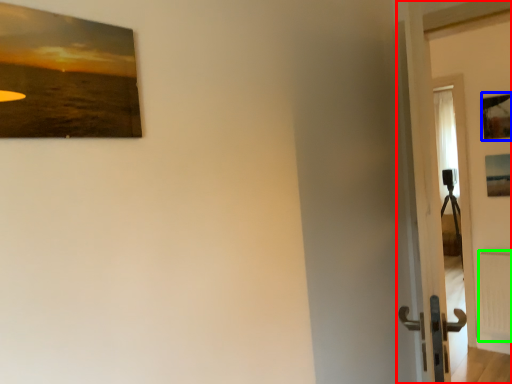
Question: Which is nearer to the door (highlighted by a red box)? picture frame (highlighted by a blue box) or radiator (highlighted by a green box).

Choices:
 (A) picture frame
 (B) radiator

Answer: (B)